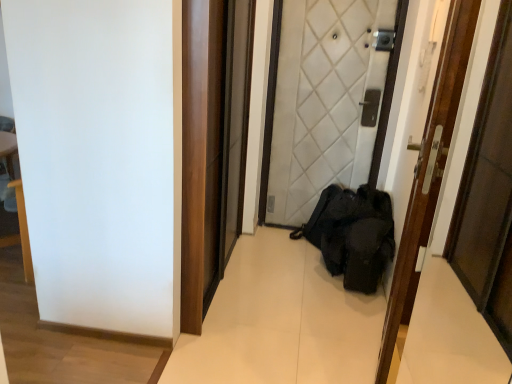
Question: Is white quilted fabric door at center, which is the second door from front to back, to the left or to the right of wooden door at center, the 1th door in the front-to-back sequence, in the image?

Choices:
 (A) left
 (B) right

Answer: (A)

Question: From a real-world perspective, is white quilted fabric door at center, the 1th door when ordered from back to front, positioned above or below wooden door at center, the 1th door in the front-to-back sequence?

Choices:
 (A) below
 (B) above

Answer: (B)

Question: Is point (281, 213) positioned closer to the camera than point (423, 196)?

Choices:
 (A) closer
 (B) farther

Answer: (B)

Question: Considering the positions of wooden door at center, the 1th door in the front-to-back sequence, and white quilted fabric door at center, which is the second door from front to back, in the image, is wooden door at center, the 1th door in the front-to-back sequence, taller or shorter than white quilted fabric door at center, which is the second door from front to back,?

Choices:
 (A) tall
 (B) short

Answer: (B)

Question: Considering the positions of point (437, 92) and point (331, 92), is point (437, 92) closer or farther from the camera than point (331, 92)?

Choices:
 (A) closer
 (B) farther

Answer: (A)

Question: From a real-world perspective, is wooden door at center, which is the second door in back-to-front order, physically located above or below white quilted fabric door at center, which is the second door from front to back?

Choices:
 (A) above
 (B) below

Answer: (B)

Question: Is wooden door at center, which is the second door in back-to-front order, wider or thinner than white quilted fabric door at center, the 1th door when ordered from back to front?

Choices:
 (A) wide
 (B) thin

Answer: (B)